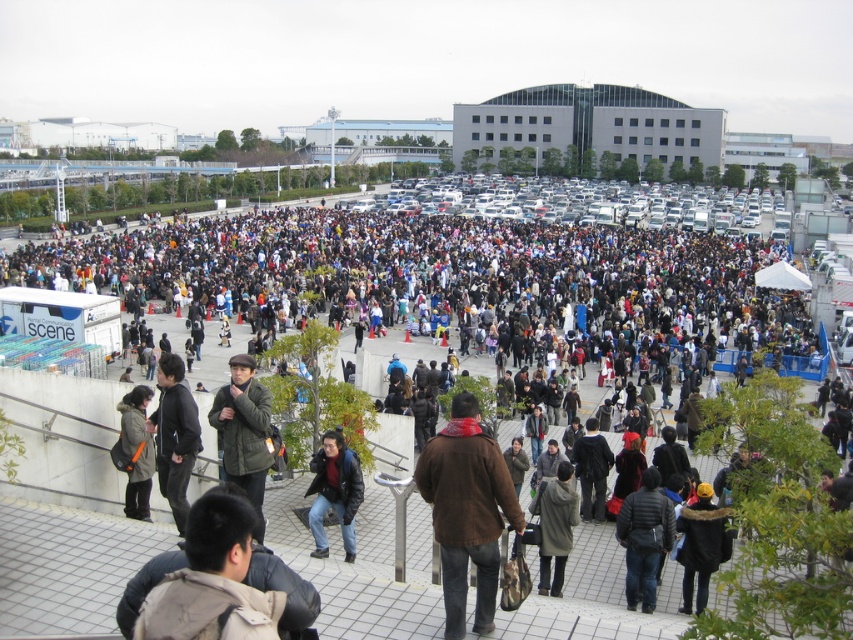
You are at the festival and want to take a photo of the crowd. You notice the brown leather jacket at center and the dark gray jacket at lower center. Which jacket is positioned closer to you?

The brown leather jacket at center is closer to the viewer than the dark gray jacket at lower center.